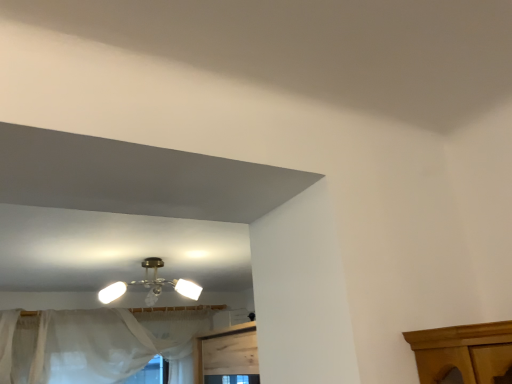
Question: Is sheer white curtain at lower left shorter than metallic brass chandelier at center?

Choices:
 (A) no
 (B) yes

Answer: (A)

Question: Considering the relative sizes of sheer white curtain at lower left and metallic brass chandelier at center in the image provided, is sheer white curtain at lower left wider than metallic brass chandelier at center?

Choices:
 (A) yes
 (B) no

Answer: (B)

Question: Could you tell me if sheer white curtain at lower left is turned towards metallic brass chandelier at center?

Choices:
 (A) no
 (B) yes

Answer: (B)

Question: Does sheer white curtain at lower left have a smaller size compared to metallic brass chandelier at center?

Choices:
 (A) yes
 (B) no

Answer: (B)

Question: Is sheer white curtain at lower left outside of metallic brass chandelier at center?

Choices:
 (A) yes
 (B) no

Answer: (A)

Question: Can you confirm if sheer white curtain at lower left is taller than metallic brass chandelier at center?

Choices:
 (A) yes
 (B) no

Answer: (A)

Question: Is sheer white curtain at lower left at the back of metallic brass chandelier at center?

Choices:
 (A) no
 (B) yes

Answer: (B)

Question: Is metallic brass chandelier at center smaller than sheer white curtain at lower left?

Choices:
 (A) no
 (B) yes

Answer: (B)

Question: Is the position of metallic brass chandelier at center less distant than that of sheer white curtain at lower left?

Choices:
 (A) no
 (B) yes

Answer: (B)

Question: Can you confirm if metallic brass chandelier at center is wider than sheer white curtain at lower left?

Choices:
 (A) no
 (B) yes

Answer: (B)

Question: Is metallic brass chandelier at center behind sheer white curtain at lower left?

Choices:
 (A) yes
 (B) no

Answer: (B)

Question: Does metallic brass chandelier at center contain sheer white curtain at lower left?

Choices:
 (A) no
 (B) yes

Answer: (A)

Question: In the image, is sheer white curtain at lower left positioned in front of or behind metallic brass chandelier at center?

Choices:
 (A) front
 (B) behind

Answer: (B)